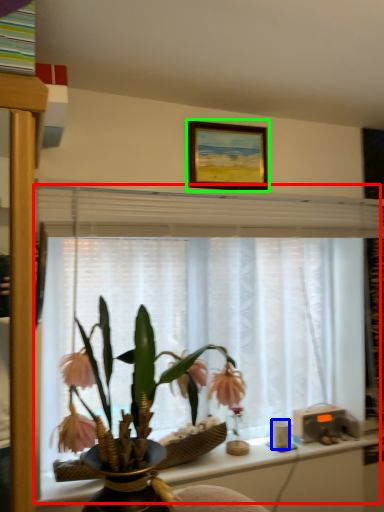
Question: Which is farther away from window frame (highlighted by a red box)? coffee cup (highlighted by a blue box) or picture frame (highlighted by a green box)?

Choices:
 (A) coffee cup
 (B) picture frame

Answer: (A)